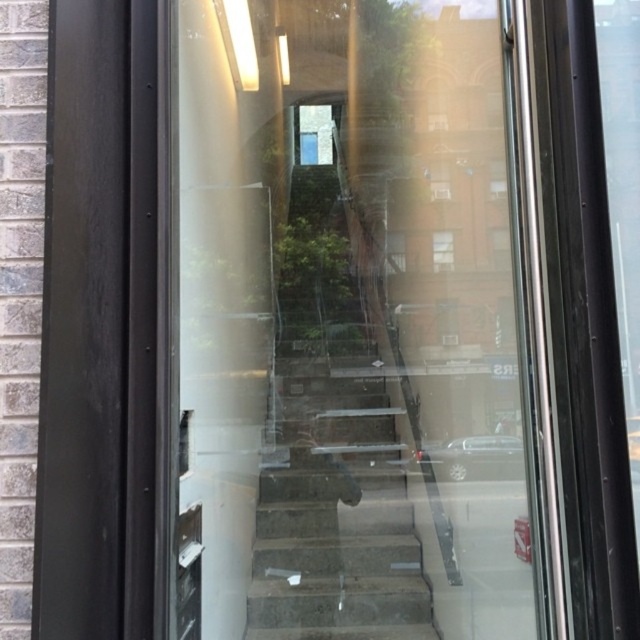
You are standing at the point marked as point (339,524) in the image. The glass door you see is 10 feet tall. Can you determine if you can reach the top of the glass door without climbing?

The point marked as point (339,524) is 12.42 feet away from you. Since the glass door is 10 feet tall, you are farther away than the height of the door, so you cannot reach the top of the glass door without climbing.

You are a delivery person trying to enter the building through the transparent glass door at center. The door is partially open, and you notice a clear glass window at center in the door. To avoid damaging the door or window, you need to know which one is wider. Which object has a greater width?

The transparent glass door at center has a greater width than the clear glass window at center according to the description.